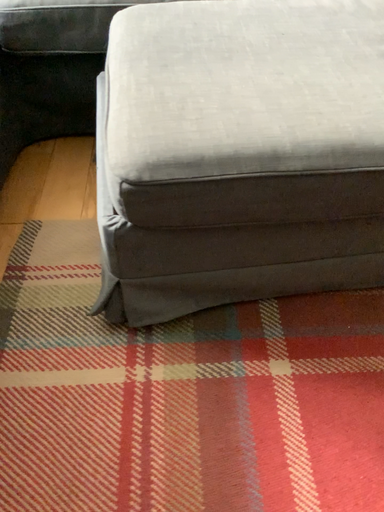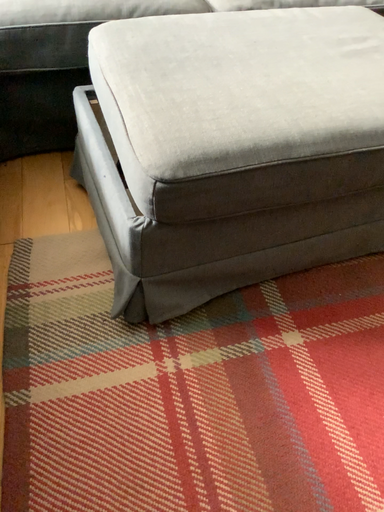
Question: How did the camera likely rotate when shooting the video?

Choices:
 (A) rotated right
 (B) rotated left

Answer: (A)